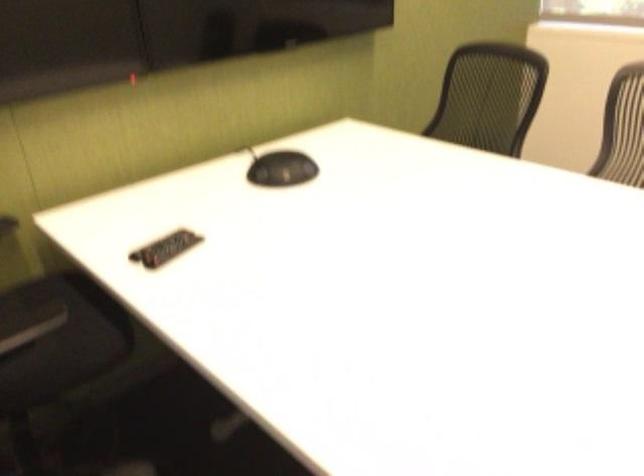
Find the location of a particular element. The height and width of the screenshot is (476, 644). black conference phone is located at coordinates (281, 169).